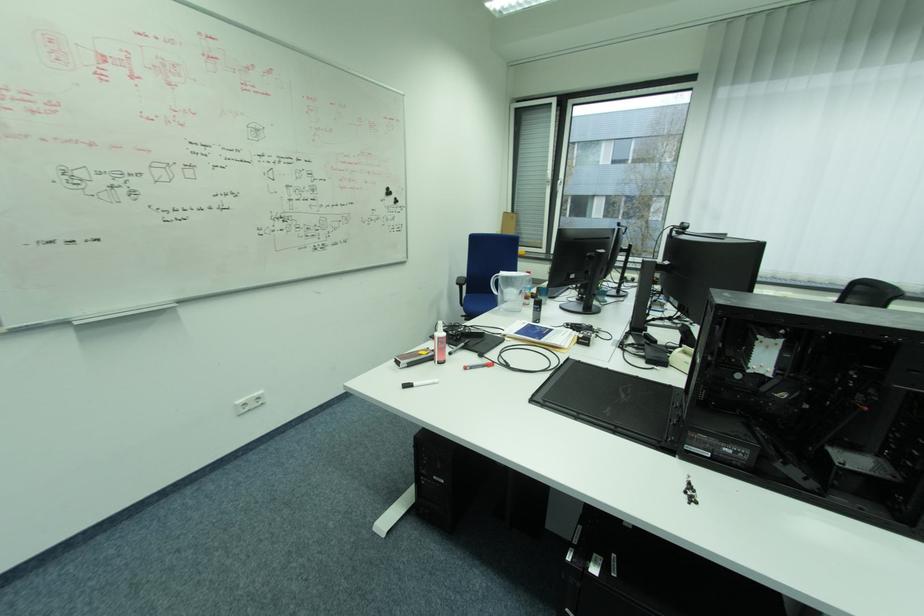
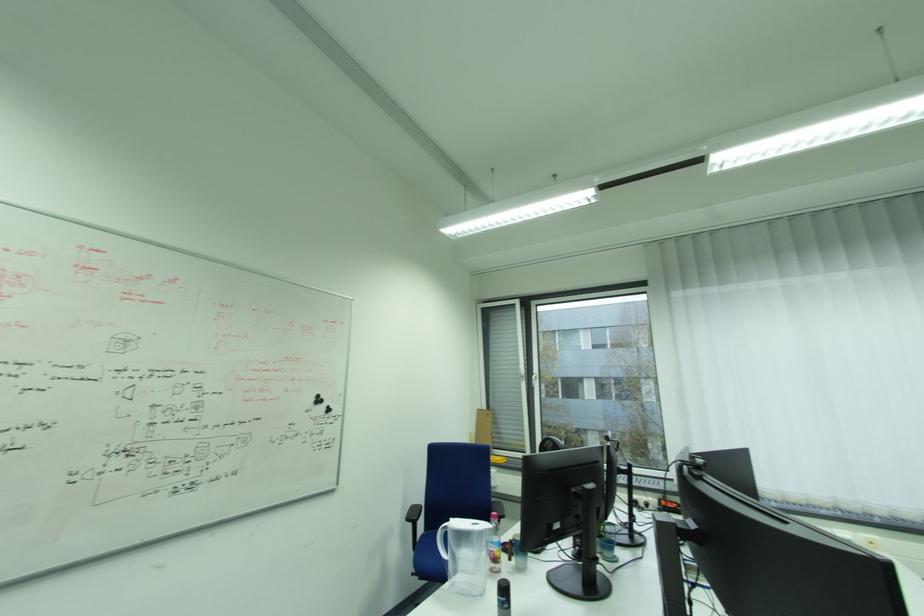
Where in the second image is the point corresponding to (541,309) from the first image?

(505, 600)